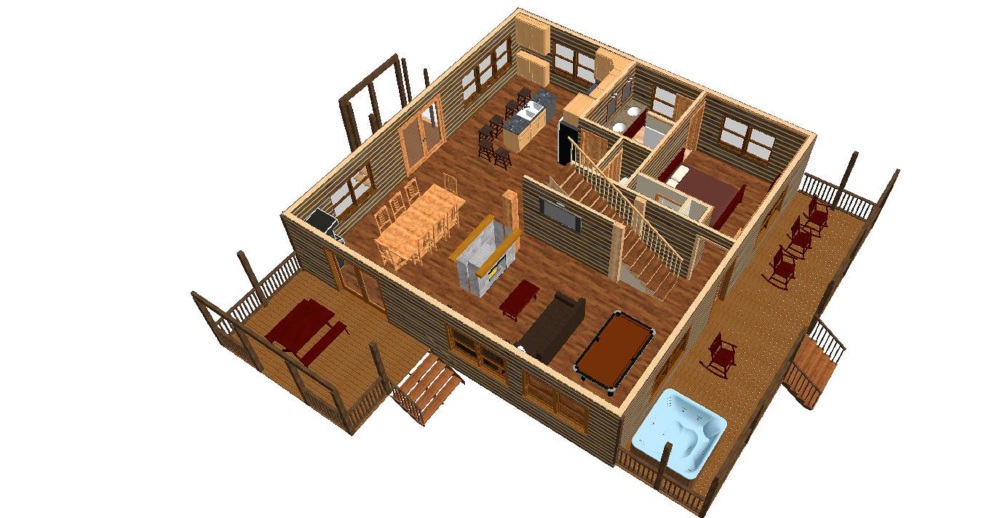
At what (x,y) coordinates should I click in order to perform the action: click on floorplan. Please return your answer as a coordinate pair (x, y). Image resolution: width=1000 pixels, height=518 pixels. Looking at the image, I should click on (575, 270).